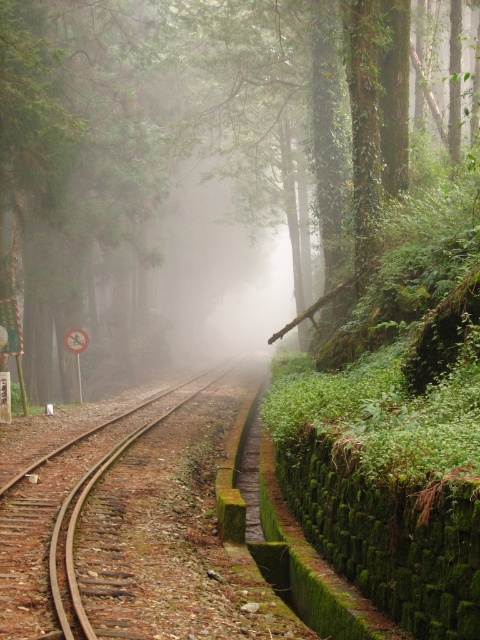
Between green leafy tree at center and rusty metal train track at center, which one is positioned lower?

rusty metal train track at center

Does green leafy tree at center have a greater height compared to rusty metal train track at center?

Yes, green leafy tree at center is taller than rusty metal train track at center.

Where is `green leafy tree at center`? This screenshot has width=480, height=640. green leafy tree at center is located at coordinates (155, 145).